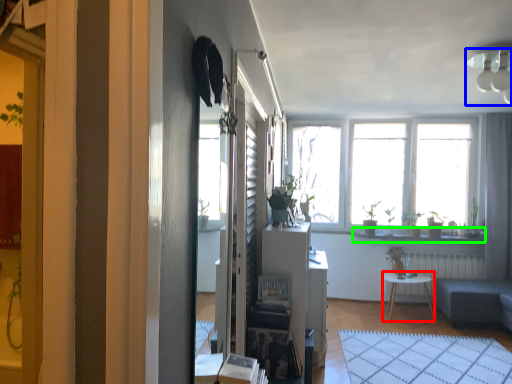
Question: Based on their relative distances, which object is farther from desk (highlighted by a red box)? Choose from lamp (highlighted by a blue box) and window sill (highlighted by a green box).

Choices:
 (A) lamp
 (B) window sill

Answer: (A)